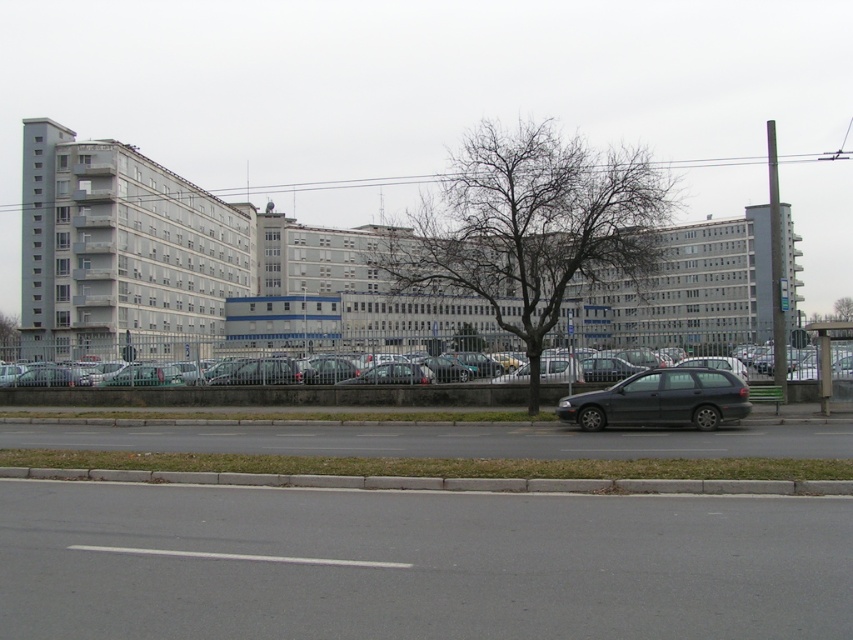
Does silver metallic sedan at center have a greater height compared to matte black station wagon at center?

Indeed, silver metallic sedan at center has a greater height compared to matte black station wagon at center.

Is silver metallic sedan at center shorter than matte black station wagon at center?

No, silver metallic sedan at center is not shorter than matte black station wagon at center.

Find the location of a particular element. silver metallic sedan at center is located at coordinates (300, 372).

Where is `silver metallic sedan at center`? This screenshot has height=640, width=853. silver metallic sedan at center is located at coordinates (300, 372).